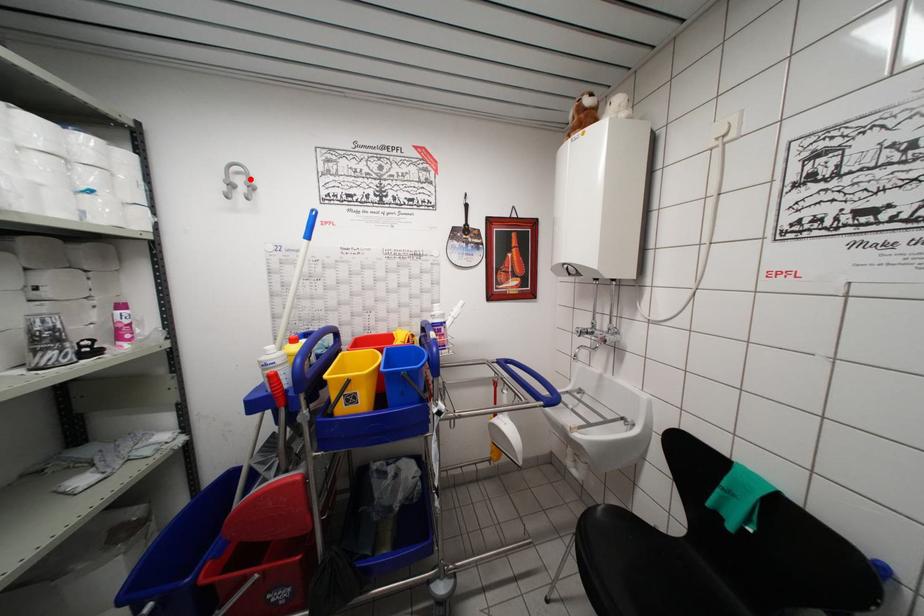
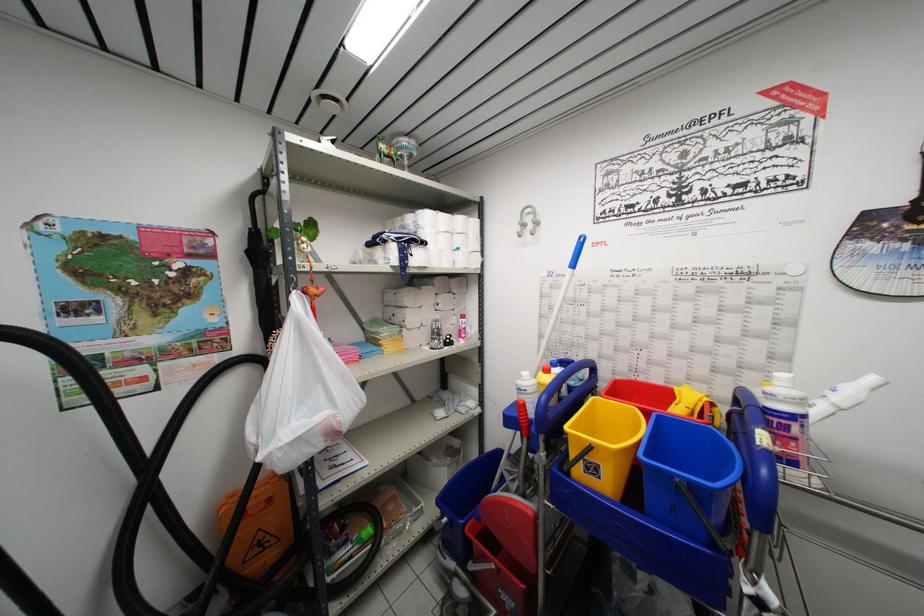
Locate, in the second image, the point that corresponds to the highlighted location in the first image.

(537, 217)